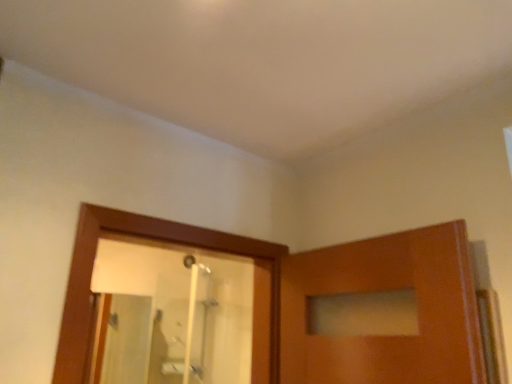
The height and width of the screenshot is (384, 512). Describe the element at coordinates (180, 314) in the screenshot. I see `clear glass mirror at center` at that location.

In order to click on clear glass mirror at center in this screenshot , I will do `click(180, 314)`.

This screenshot has height=384, width=512. I want to click on clear glass mirror at center, so click(x=180, y=314).